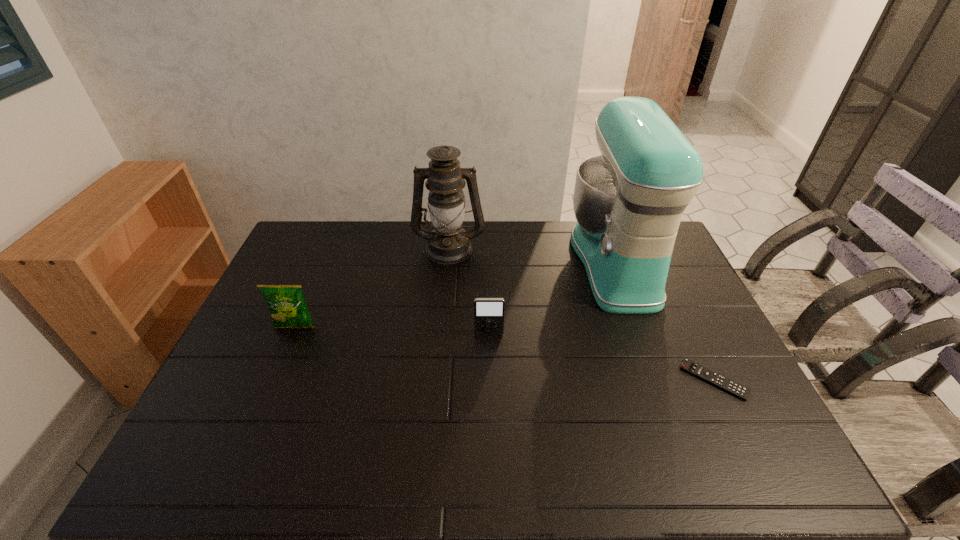
Image resolution: width=960 pixels, height=540 pixels. In order to click on free space between the shortest object and the iPod in this screenshot , I will do `click(601, 357)`.

Locate an element on the screen. This screenshot has height=540, width=960. free space between the third tallest object and the tallest object is located at coordinates (455, 295).

Find the location of a particular element. Image resolution: width=960 pixels, height=540 pixels. vacant area that lies between the fourth tallest object and the mixer is located at coordinates (x=552, y=298).

The image size is (960, 540). I want to click on object that is the fourth closest to the tallest object, so click(288, 308).

Identify which object is the fourth nearest to the crisp (potato chip). Please provide its 2D coordinates. Your answer should be formatted as a tuple, i.e. [(x, y)], where the tuple contains the x and y coordinates of a point satisfying the conditions above.

[(689, 366)]

Where is `free space that satisfies the following two spatial constraints: 1. on the back side of the nearest object; 2. at the base of the mixer`? The image size is (960, 540). free space that satisfies the following two spatial constraints: 1. on the back side of the nearest object; 2. at the base of the mixer is located at coordinates point(658,262).

At what (x,y) coordinates should I click in order to perform the action: click on vacant area that satisfies the following two spatial constraints: 1. on the front-facing side of the second shortest object; 2. on the right side of the nearest object. Please return your answer as a coordinate pair (x, y). This screenshot has width=960, height=540. Looking at the image, I should click on (490, 380).

This screenshot has height=540, width=960. I want to click on free spot that satisfies the following two spatial constraints: 1. at the base of the tallest object; 2. on the front-facing side of the second shortest object, so click(640, 334).

You are a GUI agent. You are given a task and a screenshot of the screen. Output one action in this format:
    pyautogui.click(x=<x>, y=<y>)
    Task: Click on the free point that satisfies the following two spatial constraints: 1. at the base of the tallest object; 2. on the front-facing side of the leftmost object
    This screenshot has height=540, width=960.
    Given the screenshot: What is the action you would take?
    pyautogui.click(x=638, y=327)

This screenshot has height=540, width=960. Find the location of `free space that satisfies the following two spatial constraints: 1. at the base of the mixer; 2. on the right side of the shortest object`. free space that satisfies the following two spatial constraints: 1. at the base of the mixer; 2. on the right side of the shortest object is located at coordinates (658, 380).